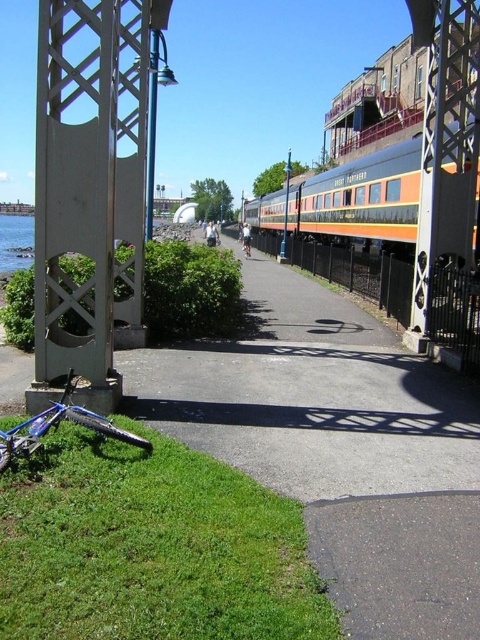
You are a gardener who needs to mow the lawn. You see the green grass at lower left and the blue matte bicycle at center. Which area should you avoid mowing to prevent damaging the bicycle?

You should avoid mowing near the blue matte bicycle at center because the green grass at lower left is shorter than the blue matte bicycle at center, meaning the bicycle is taller and could be hit by the mower.

You are standing at the origin point of the image coordinate system. Can you tell me the coordinates of the clear water at lower left?

The clear water at lower left is located at coordinates point (x=15, y=241).